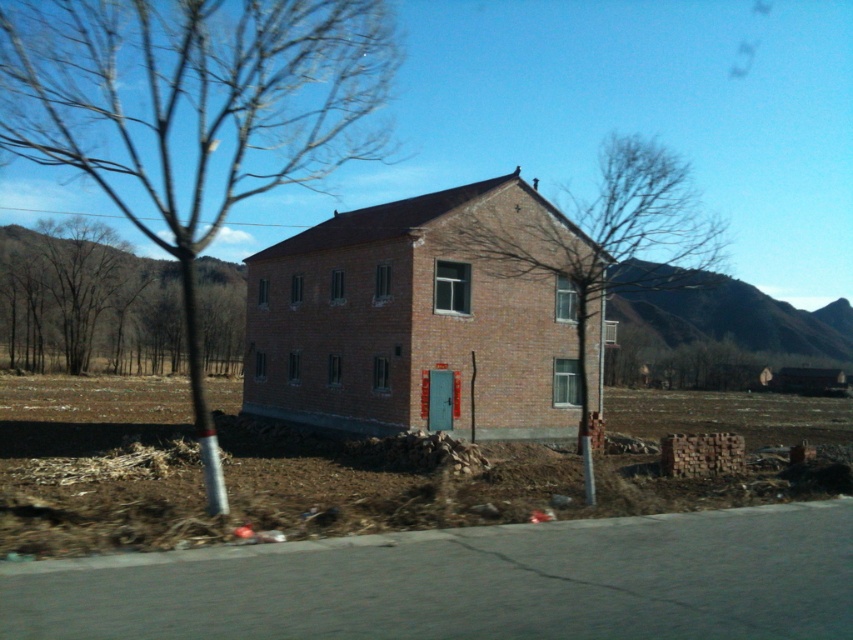
Is bare wood tree at center to the right of brown leafless tree at center from the viewer's perspective?

No, bare wood tree at center is not to the right of brown leafless tree at center.

Which is in front, point (12, 326) or point (511, 227)?

Positioned in front is point (511, 227).

Is point (215, 317) positioned before point (645, 172)?

No, it is behind (645, 172).

The image size is (853, 640). I want to click on bare wood tree at center, so click(x=86, y=304).

Who is shorter, bare branches at center or bare wood tree at center?

Standing shorter between the two is bare wood tree at center.

Is bare branches at center further to the viewer compared to bare wood tree at center?

No, it is not.

Between point (120, 186) and point (206, 316), which one is positioned behind?

Positioned behind is point (120, 186).

Where is `bare branches at center`? This screenshot has width=853, height=640. bare branches at center is located at coordinates (193, 113).

Which of these two, bare branches at center or brown leafless tree at center, stands shorter?

bare branches at center is shorter.

Between bare branches at center and brown leafless tree at center, which one has more height?

brown leafless tree at center is taller.

Who is more forward, (199, 440) or (563, 262)?

Point (199, 440) is in front.

Locate an element on the screen. The image size is (853, 640). bare branches at center is located at coordinates (193, 113).